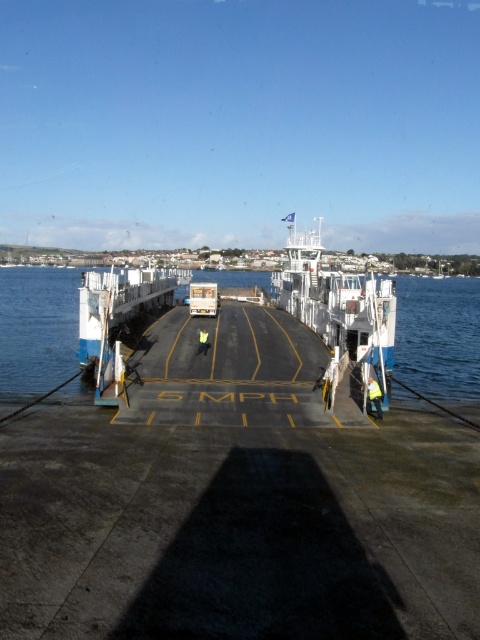
Where is `white plastic container at center`? white plastic container at center is located at coordinates (203, 298).

Measure the distance from white plastic container at center to yellow reflective vest at center.

white plastic container at center and yellow reflective vest at center are 25.87 feet apart from each other.

You are a GUI agent. You are given a task and a screenshot of the screen. Output one action in this format:
    pyautogui.click(x=<x>, y=<y>)
    Task: Click on the white plastic container at center
    
    Given the screenshot: What is the action you would take?
    pyautogui.click(x=203, y=298)

Is blue water at center positioned in front of yellow reflective vest at lower right?

No, it is behind yellow reflective vest at lower right.

Who is more distant from viewer, (465, 340) or (382, 397)?

The point (465, 340) is behind.

In order to click on blue water at center in this screenshot , I will do `click(439, 336)`.

Does blue water at center have a lesser width compared to white plastic container at center?

In fact, blue water at center might be wider than white plastic container at center.

Can you confirm if blue water at center is wider than white plastic container at center?

Correct, the width of blue water at center exceeds that of white plastic container at center.

Is point (13, 285) in front of point (190, 308)?

No, (13, 285) is further to viewer.

Image resolution: width=480 pixels, height=640 pixels. I want to click on blue water at center, so click(439, 336).